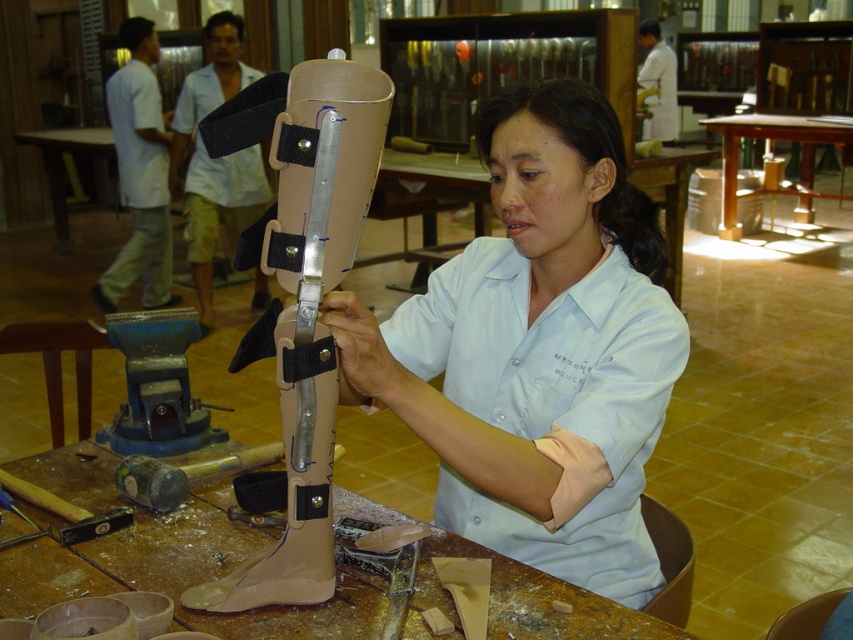
Question: From the image, what is the correct spatial relationship of tan matte prosthetic leg at center in relation to wooden table at center?

Choices:
 (A) above
 (B) below

Answer: (B)

Question: Which point is closer to the camera?

Choices:
 (A) matte beige prosthetic leg at center
 (B) wooden table at center

Answer: (A)

Question: Is matte beige prosthetic leg at center to the right of wooden table at center from the viewer's perspective?

Choices:
 (A) no
 (B) yes

Answer: (A)

Question: Where is matte beige prosthetic leg at center located in relation to tan matte prosthetic leg at center in the image?

Choices:
 (A) left
 (B) right

Answer: (B)

Question: Based on their relative distances, which object is nearer to the wooden table at center?

Choices:
 (A) tan matte prosthetic leg at center
 (B) matte beige prosthetic leg at center

Answer: (B)

Question: Estimate the real-world distances between objects in this image. Which object is closer to the matte beige prosthetic leg at center?

Choices:
 (A) wooden table at center
 (B) tan matte prosthetic leg at center

Answer: (B)